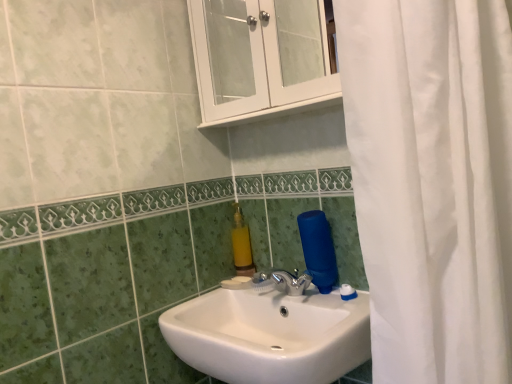
Question: Relative to white glossy cabinet at upper center, is yellow matte soap dispenser at upper center in front or behind?

Choices:
 (A) behind
 (B) front

Answer: (A)

Question: Is point (245, 241) positioned closer to the camera than point (264, 66)?

Choices:
 (A) closer
 (B) farther

Answer: (B)

Question: Considering the real-world distances, which object is closest to the white glossy cabinet at upper center?

Choices:
 (A) white glossy sink at center
 (B) yellow matte soap dispenser at upper center

Answer: (B)

Question: Which object is the farthest from the white glossy cabinet at upper center?

Choices:
 (A) yellow matte soap dispenser at upper center
 (B) white glossy sink at center

Answer: (B)